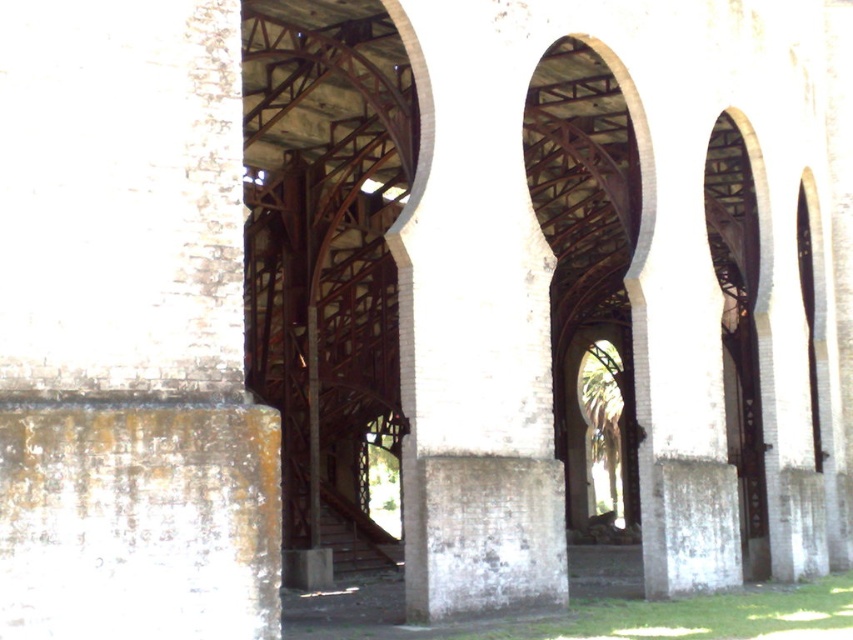
Question: Among these points, which one is farthest from the camera?

Choices:
 (A) (393, 4)
 (B) (788, 529)

Answer: (B)

Question: Which of the following is the farthest from the observer?

Choices:
 (A) (801, 237)
 (B) (523, 378)

Answer: (A)

Question: Does rusty metal bridge at center have a lesser width compared to white brick pillar at center?

Choices:
 (A) yes
 (B) no

Answer: (B)

Question: Is rusty metal bridge at center positioned in front of white brick pillar at center?

Choices:
 (A) no
 (B) yes

Answer: (B)

Question: Can you confirm if rusty metal bridge at center is positioned below white brick pillar at center?

Choices:
 (A) yes
 (B) no

Answer: (B)